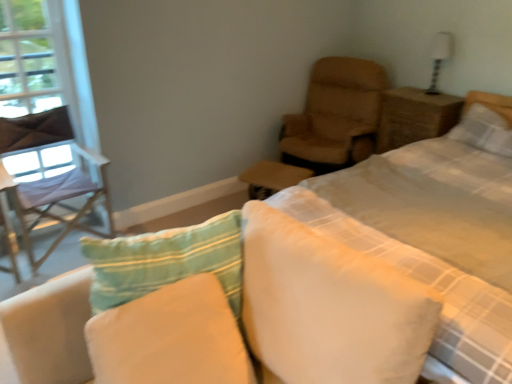
You are a GUI agent. You are given a task and a screenshot of the screen. Output one action in this format:
    pyautogui.click(x=<x>, y=<y>)
    Task: Click on the vacant space positioned to the left of white glossy table lamp at upper right
    Image resolution: width=512 pixels, height=384 pixels.
    Given the screenshot: What is the action you would take?
    pyautogui.click(x=412, y=97)